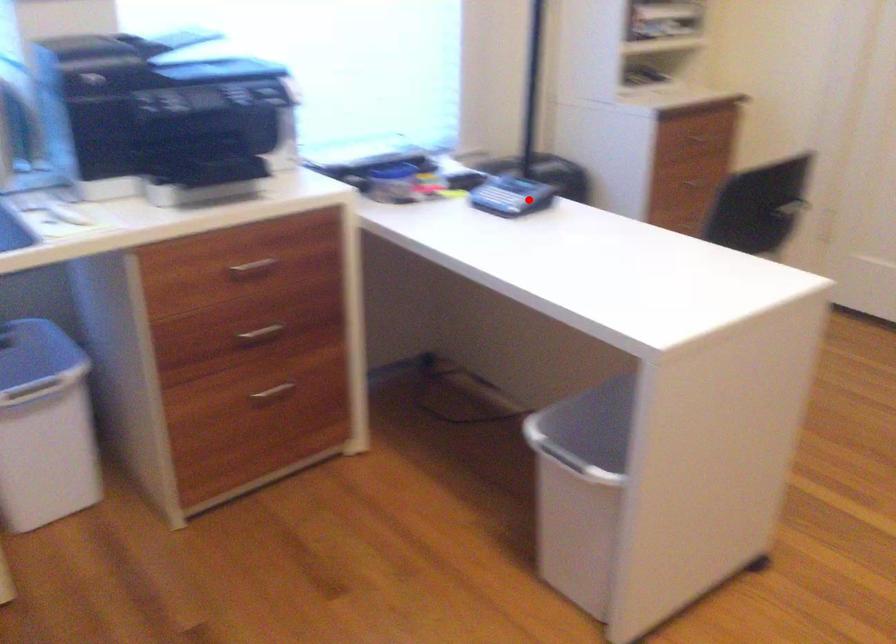
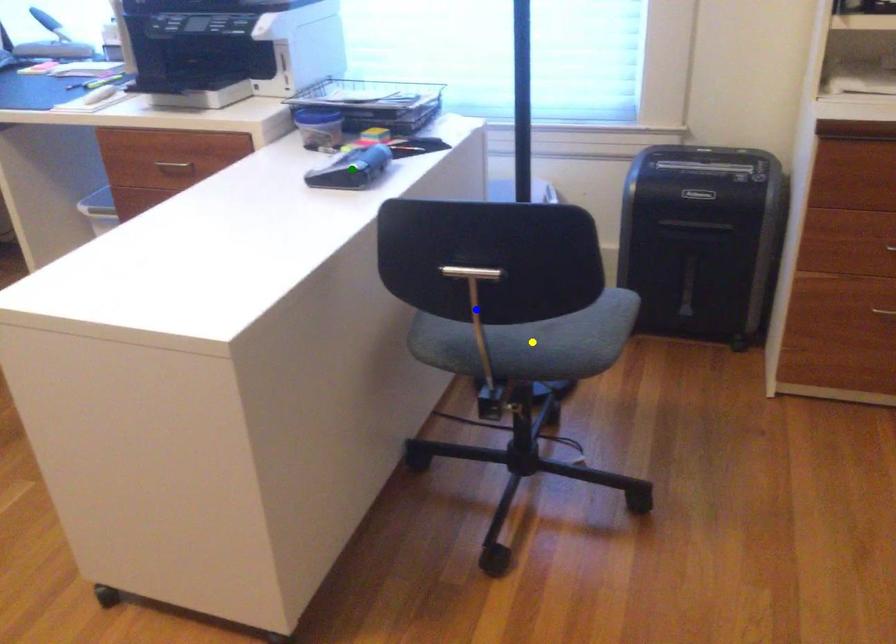
Question: I am providing you with two images of the same scene from different viewpoints. A red point is marked on the first image. You are given multiple points on the second image. Can you choose the point in image 2 that corresponds to the point in image 1?

Choices:
 (A) green point
 (B) blue point
 (C) yellow point

Answer: (A)